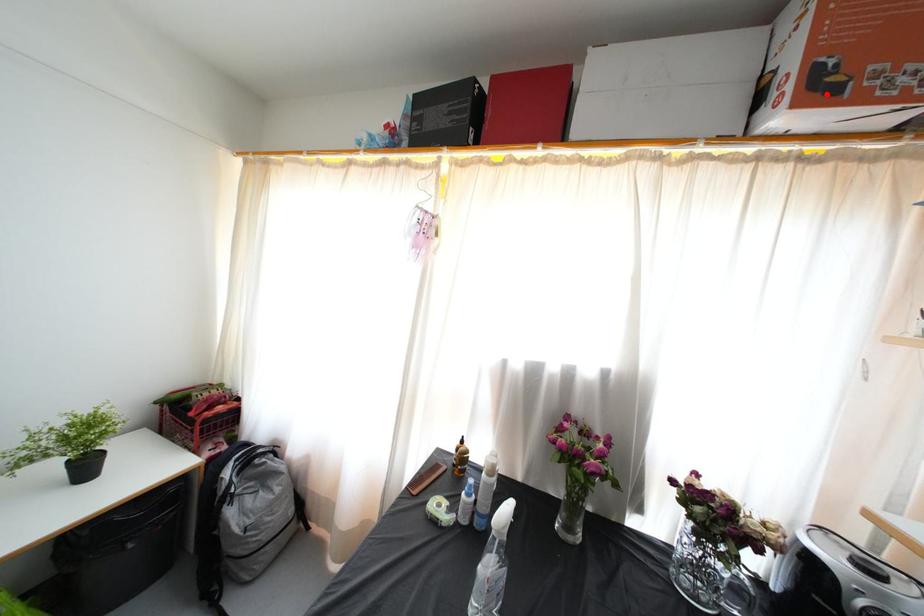
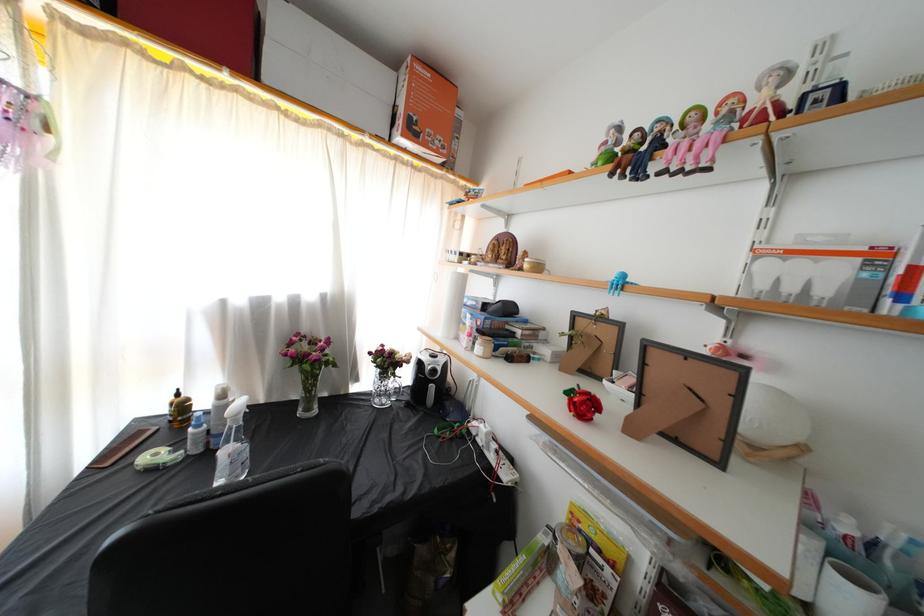
Question: I am providing you with two images of the same scene from different viewpoints. In image1, a red point is highlighted. Considering the same 3D point in image2, which of the following is correct?

Choices:
 (A) It is closer
 (B) It is farther

Answer: (A)